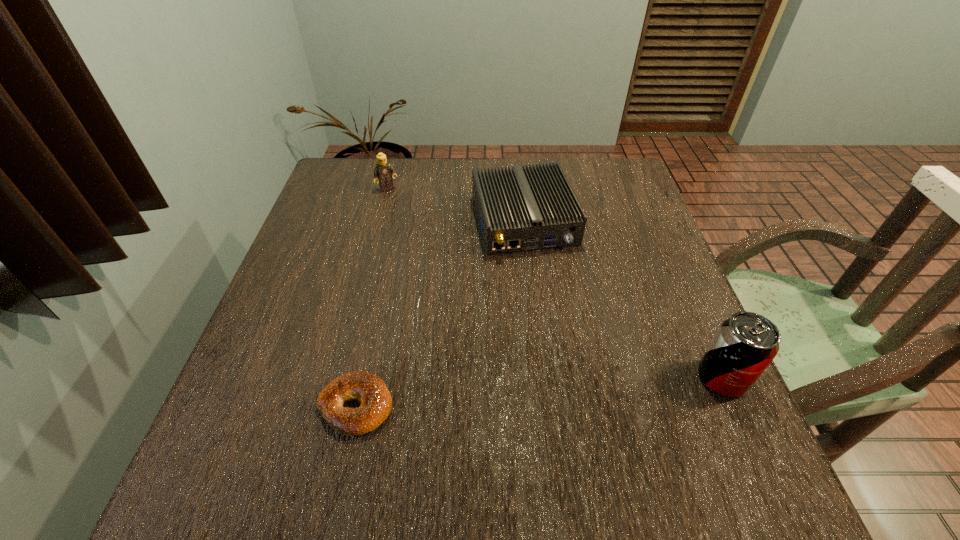
Identify the location of object located in the far left corner section of the desktop. The width and height of the screenshot is (960, 540). (384, 172).

The width and height of the screenshot is (960, 540). What are the coordinates of `object that is at the near right corner` in the screenshot? It's located at (746, 343).

Where is `free space at the far edge of the desktop`? free space at the far edge of the desktop is located at coordinates (492, 166).

In order to click on vacant space at the near edge of the desktop in this screenshot , I will do 455,406.

Where is `vacant space at the left edge`? The height and width of the screenshot is (540, 960). vacant space at the left edge is located at coordinates (256, 339).

The height and width of the screenshot is (540, 960). In the image, there is a desktop. Find the location of `vacant region at the right edge`. vacant region at the right edge is located at coordinates (x=617, y=258).

At what (x,y) coordinates should I click in order to perform the action: click on vacant region at the far left corner of the desktop. Please return your answer as a coordinate pair (x, y). This screenshot has width=960, height=540. Looking at the image, I should click on (373, 203).

In order to click on free spot between the rightmost object and the second shortest object in this screenshot , I will do `click(623, 300)`.

Where is `free space between the second shortest object and the soda can`? The image size is (960, 540). free space between the second shortest object and the soda can is located at coordinates (623, 300).

At what (x,y) coordinates should I click in order to perform the action: click on free space between the bagel and the router. Please return your answer as a coordinate pair (x, y). Looking at the image, I should click on (440, 314).